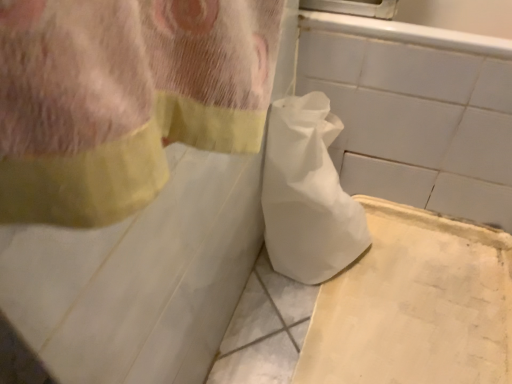
Question: Considering the relative positions of white paper bag at center and white cardboard at lower right in the image provided, is white paper bag at center to the right of white cardboard at lower right from the viewer's perspective?

Choices:
 (A) yes
 (B) no

Answer: (B)

Question: Considering the relative sizes of white paper bag at center and white cardboard at lower right in the image provided, is white paper bag at center taller than white cardboard at lower right?

Choices:
 (A) no
 (B) yes

Answer: (B)

Question: Is white paper bag at center facing away from white cardboard at lower right?

Choices:
 (A) no
 (B) yes

Answer: (A)

Question: From the image's perspective, would you say white paper bag at center is positioned over white cardboard at lower right?

Choices:
 (A) no
 (B) yes

Answer: (B)

Question: Can you confirm if white paper bag at center is smaller than white cardboard at lower right?

Choices:
 (A) no
 (B) yes

Answer: (A)

Question: From the image's perspective, is white paper bag at center beneath white cardboard at lower right?

Choices:
 (A) yes
 (B) no

Answer: (B)

Question: Is white cardboard at lower right at the left side of white paper bag at center?

Choices:
 (A) yes
 (B) no

Answer: (B)

Question: Is white cardboard at lower right in front of white paper bag at center?

Choices:
 (A) yes
 (B) no

Answer: (B)

Question: Considering the relative sizes of white cardboard at lower right and white paper bag at center in the image provided, is white cardboard at lower right wider than white paper bag at center?

Choices:
 (A) yes
 (B) no

Answer: (A)

Question: From a real-world perspective, is white cardboard at lower right below white paper bag at center?

Choices:
 (A) no
 (B) yes

Answer: (B)

Question: Does white cardboard at lower right have a greater height compared to white paper bag at center?

Choices:
 (A) yes
 (B) no

Answer: (B)

Question: Considering the relative sizes of white cardboard at lower right and white paper bag at center in the image provided, is white cardboard at lower right bigger than white paper bag at center?

Choices:
 (A) no
 (B) yes

Answer: (A)

Question: Is white cardboard at lower right to the left or to the right of white paper bag at center in the image?

Choices:
 (A) right
 (B) left

Answer: (A)